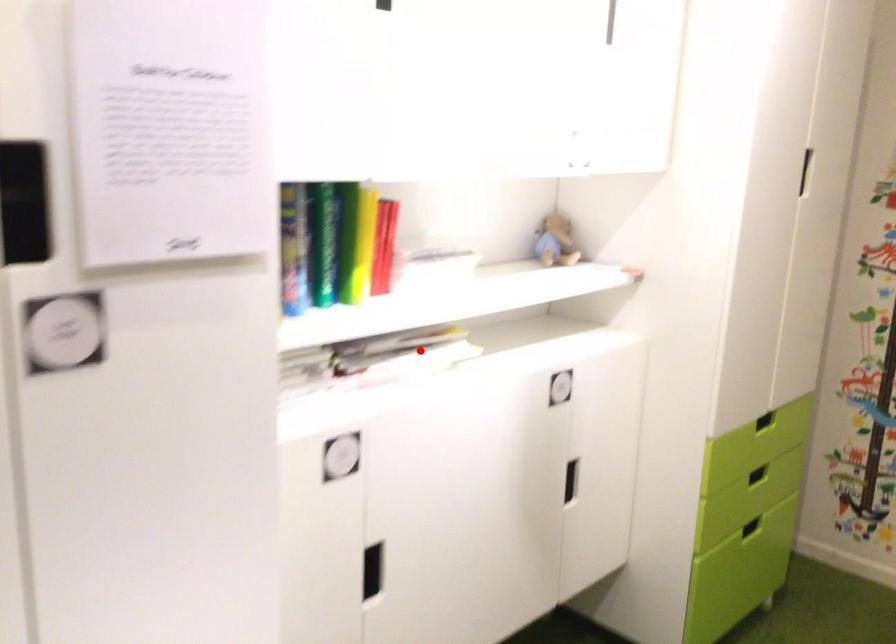
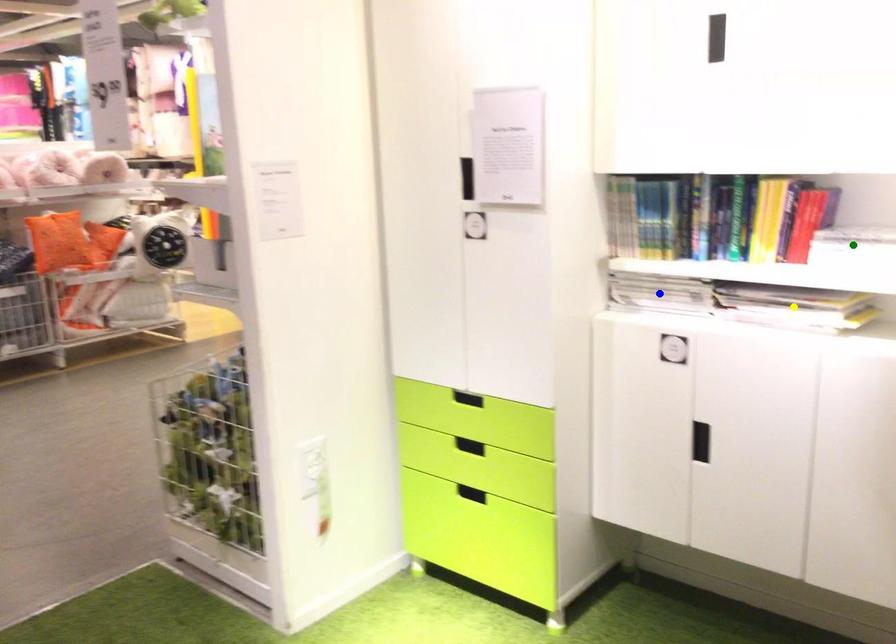
Question: I am providing you with two images of the same scene from different viewpoints. A red point is marked on the first image. You are given multiple points on the second image. Can you choose the point in image 2 that corresponds to the point in image 1?

Choices:
 (A) yellow point
 (B) blue point
 (C) green point

Answer: (A)